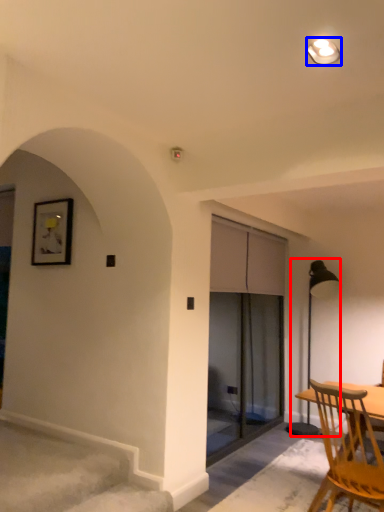
Question: Among these objects, which one is farthest to the camera, lamp (highlighted by a red box) or light fixture (highlighted by a blue box)?

Choices:
 (A) lamp
 (B) light fixture

Answer: (A)